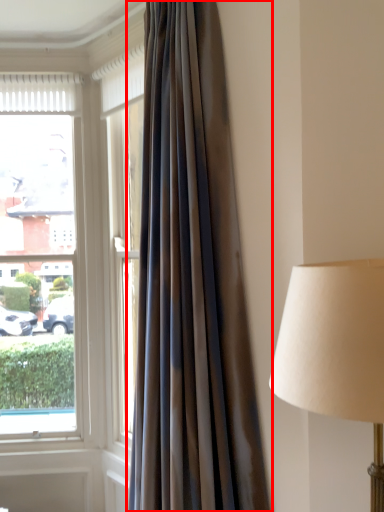
Question: From the image's perspective, where is curtain (annotated by the red box) located in relation to window in the image?

Choices:
 (A) below
 (B) above

Answer: (B)